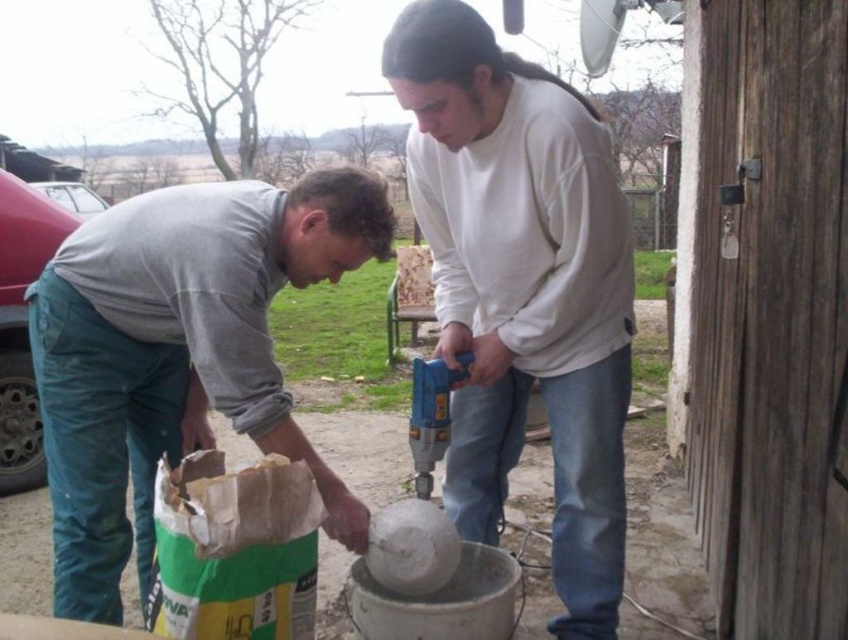
Question: Which of the following is the farthest from the observer?

Choices:
 (A) green paper bag at lower left
 (B) blue plastic drill at center
 (C) white matte drill at center

Answer: (B)

Question: Which point appears farthest from the camera in this image?

Choices:
 (A) (528, 268)
 (B) (45, 365)
 (C) (289, 618)

Answer: (A)

Question: Can you confirm if white matte drill at center is wider than green paper bag at lower left?

Choices:
 (A) no
 (B) yes

Answer: (B)

Question: Is white matte drill at center closer to camera compared to gray fabric shirt at lower left?

Choices:
 (A) no
 (B) yes

Answer: (B)

Question: Estimate the real-world distances between objects in this image. Which object is farther from the blue plastic drill at center?

Choices:
 (A) green paper bag at lower left
 (B) gray fabric shirt at lower left

Answer: (B)

Question: Does white matte drill at center have a larger size compared to gray fabric shirt at lower left?

Choices:
 (A) no
 (B) yes

Answer: (B)